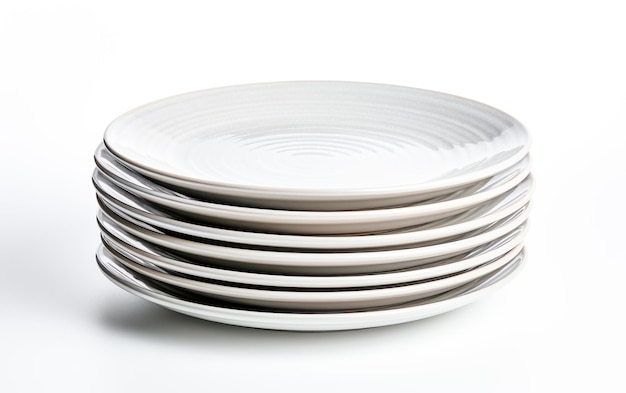
This screenshot has width=626, height=393. Find the location of `white stacked plates`. white stacked plates is located at coordinates (356, 198), (355, 224), (357, 241), (356, 262), (359, 280), (357, 297), (359, 318).